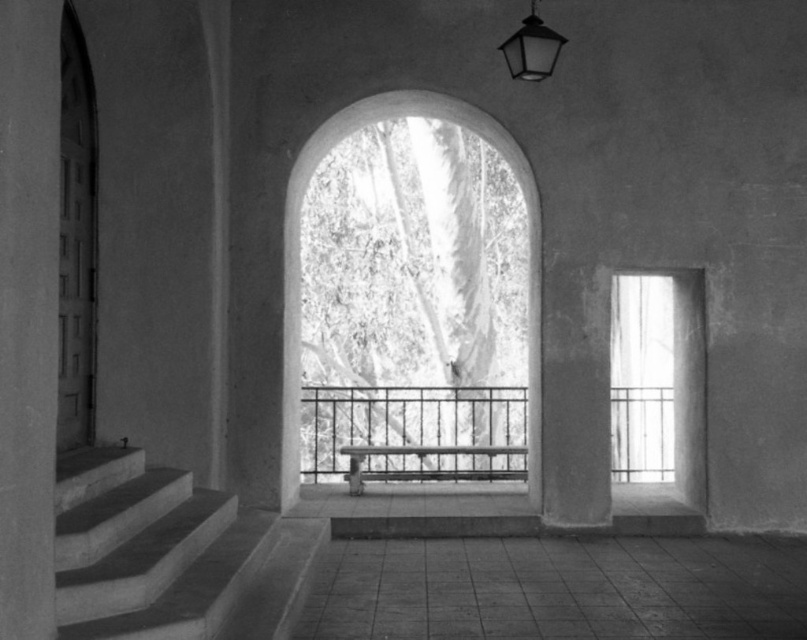
Between matte black lantern at upper center and smooth metal bench at center, which one has more height?

With more height is matte black lantern at upper center.

Can you confirm if matte black lantern at upper center is thinner than smooth metal bench at center?

Yes.

Between point (509, 44) and point (507, 448), which one is positioned behind?

Point (507, 448)

Find the location of `matte black lantern at upper center`. matte black lantern at upper center is located at coordinates coord(530,49).

Is point (148, 541) in front of point (657, 388)?

Yes, point (148, 541) is closer to viewer.

Based on the photo, between smooth concrete stairs at lower left and clear glass window at right, which one is positioned lower?

clear glass window at right is below.

The height and width of the screenshot is (640, 807). What do you see at coordinates (147, 548) in the screenshot?
I see `smooth concrete stairs at lower left` at bounding box center [147, 548].

Where is `smooth concrete stairs at lower left`? Image resolution: width=807 pixels, height=640 pixels. smooth concrete stairs at lower left is located at coordinates (147, 548).

Can you confirm if metallic black balustrade at center is thinner than translucent glass bench at center?

No.

Based on the photo, is metallic black balustrade at center to the right of translucent glass bench at center from the viewer's perspective?

No, metallic black balustrade at center is not to the right of translucent glass bench at center.

Which is behind, point (458, 448) or point (537, 484)?

The point (458, 448) is more distant.

Locate an element on the screen. This screenshot has width=807, height=640. metallic black balustrade at center is located at coordinates click(415, 432).